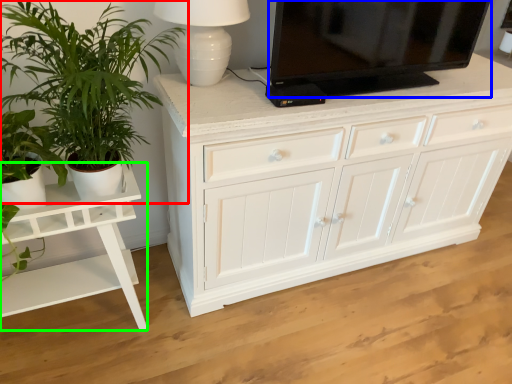
Question: Which is nearer to the houseplant (highlighted by a red box)? television (highlighted by a blue box) or table (highlighted by a green box).

Choices:
 (A) television
 (B) table

Answer: (B)